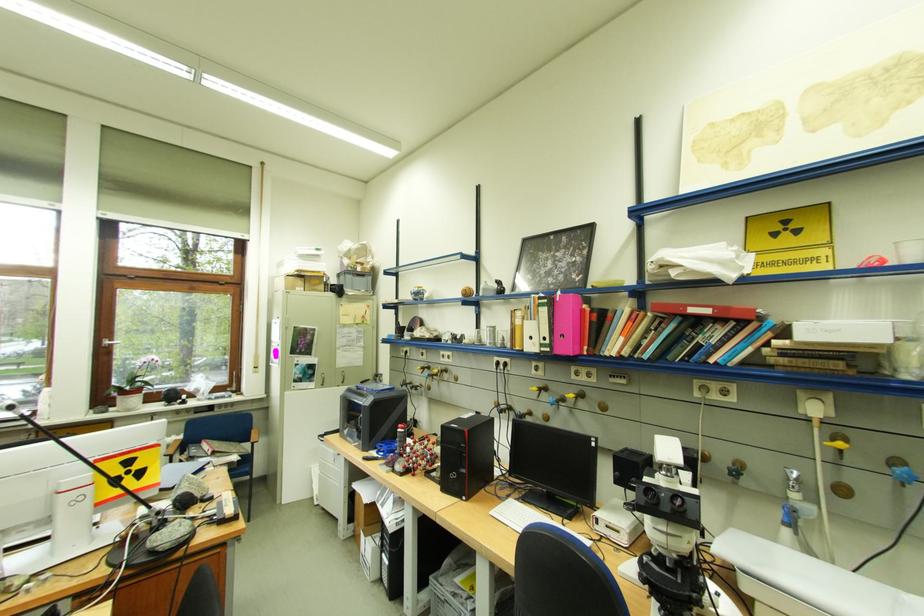
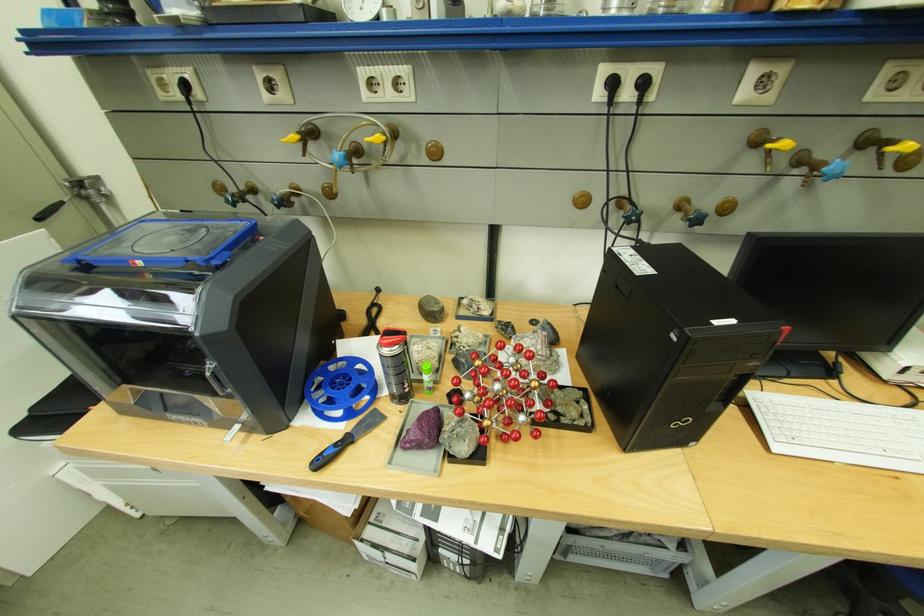
Find the pixel in the second image that matches point (385, 392) in the first image.

(219, 261)